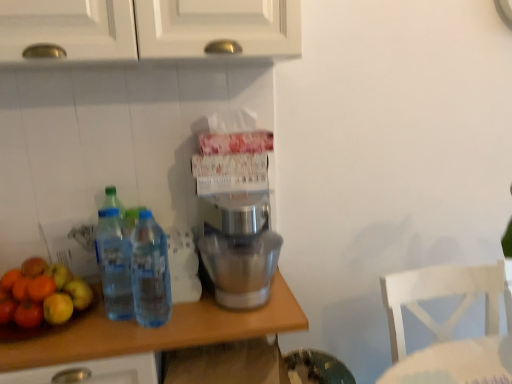
The width and height of the screenshot is (512, 384). What are the coordinates of `free space to the right of clear plastic bottles at center, the first bottle in the right-to-left sequence` in the screenshot? It's located at (208, 320).